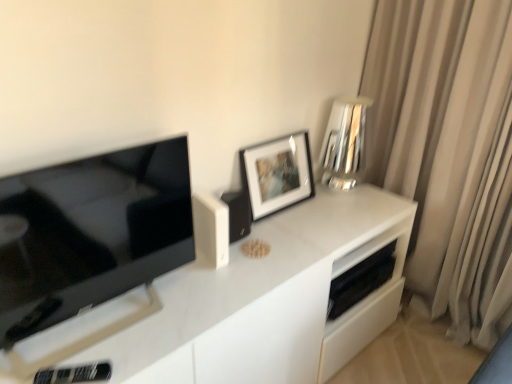
Question: Looking at the image, does black glossy tv at left seem bigger or smaller compared to black plastic remote control at lower left, which is counted as the first appliance, starting from the left?

Choices:
 (A) big
 (B) small

Answer: (A)

Question: Is point (51, 228) closer or farther from the camera than point (110, 372)?

Choices:
 (A) closer
 (B) farther

Answer: (A)

Question: Which of these objects is positioned farthest from the white matte speaker at center, which ranks as the second appliance in front-to-back order?

Choices:
 (A) black matte speaker at lower right, marked as the 5th appliance in a left-to-right arrangement
 (B) black matte speaker at upper center, the third appliance in the left-to-right sequence
 (C) white matte picture frame at upper center
 (D) black plastic remote control at lower left, the 5th appliance viewed from the right
 (E) silver reflective vase at upper right, the 2th appliance viewed from the back

Answer: (E)

Question: Which is farther from the black matte speaker at upper center, marked as the 3th appliance in a front-to-back arrangement?

Choices:
 (A) white matte picture frame at upper center
 (B) silver reflective vase at upper right, the 2th appliance viewed from the back
 (C) black matte speaker at lower right, which appears as the 1th appliance when viewed from the right
 (D) black plastic remote control at lower left, the 5th appliance viewed from the right
 (E) beige fabric curtain at right

Answer: (E)